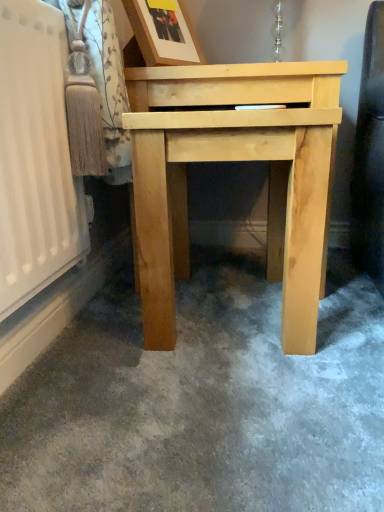
Question: Does wooden picture frame at upper center appear on the left side of natural wood table at center?

Choices:
 (A) yes
 (B) no

Answer: (A)

Question: Considering the relative sizes of wooden picture frame at upper center and natural wood table at center in the image provided, is wooden picture frame at upper center shorter than natural wood table at center?

Choices:
 (A) yes
 (B) no

Answer: (A)

Question: Is wooden picture frame at upper center outside of natural wood table at center?

Choices:
 (A) yes
 (B) no

Answer: (A)

Question: Can you confirm if wooden picture frame at upper center is thinner than natural wood table at center?

Choices:
 (A) no
 (B) yes

Answer: (B)

Question: Is wooden picture frame at upper center at the right side of natural wood table at center?

Choices:
 (A) no
 (B) yes

Answer: (A)

Question: Can you see wooden picture frame at upper center touching natural wood table at center?

Choices:
 (A) yes
 (B) no

Answer: (B)

Question: Is natural wood table at center oriented towards wooden picture frame at upper center?

Choices:
 (A) no
 (B) yes

Answer: (A)

Question: Could wooden picture frame at upper center be considered to be inside natural wood table at center?

Choices:
 (A) no
 (B) yes

Answer: (A)

Question: From the image's perspective, is natural wood table at center below wooden picture frame at upper center?

Choices:
 (A) no
 (B) yes

Answer: (B)

Question: Does natural wood table at center touch wooden picture frame at upper center?

Choices:
 (A) yes
 (B) no

Answer: (B)

Question: Is natural wood table at center smaller than wooden picture frame at upper center?

Choices:
 (A) no
 (B) yes

Answer: (A)

Question: From the image's perspective, is natural wood table at center on wooden picture frame at upper center?

Choices:
 (A) yes
 (B) no

Answer: (B)

Question: Is point (144, 30) closer or farther from the camera than point (152, 116)?

Choices:
 (A) closer
 (B) farther

Answer: (B)